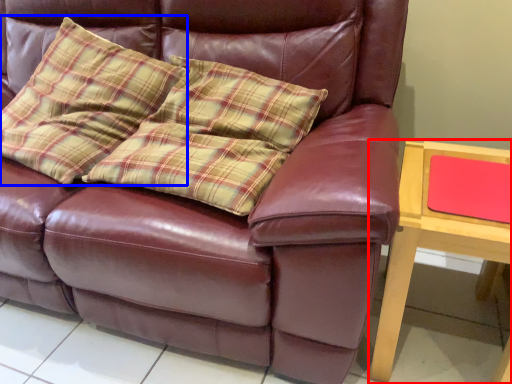
Question: Which point is closer to the camera, table (highlighted by a red box) or throw pillow (highlighted by a blue box)?

Choices:
 (A) table
 (B) throw pillow

Answer: (A)